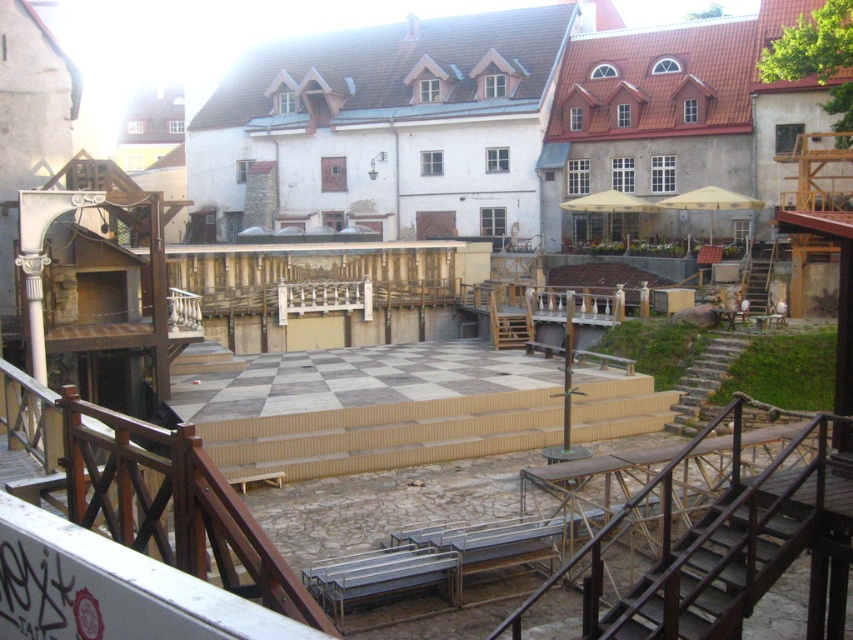
Question: Which object is farther from the camera taking this photo?

Choices:
 (A) stone stairs at right
 (B) dark brown wooden stairs at lower right

Answer: (A)

Question: Which is farther from the stone stairs at right?

Choices:
 (A) dark brown wooden stairs at lower right
 (B) wooden stairs at right

Answer: (A)

Question: Observing the image, what is the correct spatial positioning of stone stairs at right in reference to wooden stairs at right?

Choices:
 (A) below
 (B) above

Answer: (A)

Question: Is dark brown wooden stairs at lower right to the right of wooden stairs at right from the viewer's perspective?

Choices:
 (A) no
 (B) yes

Answer: (A)

Question: Which point is closer to the camera?

Choices:
 (A) (708, 385)
 (B) (735, 516)

Answer: (B)

Question: In this image, where is stone stairs at right located relative to wooden stairs at right?

Choices:
 (A) above
 (B) below

Answer: (B)